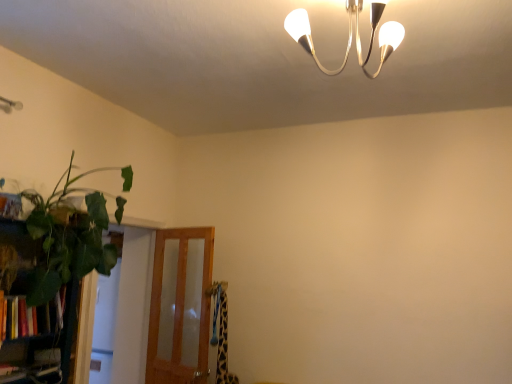
Question: Is hardcover books at left far from translucent wood screen door at lower left?

Choices:
 (A) yes
 (B) no

Answer: (A)

Question: Are hardcover books at left and translucent wood screen door at lower left beside each other?

Choices:
 (A) no
 (B) yes

Answer: (A)

Question: Is hardcover books at left looking in the opposite direction of translucent wood screen door at lower left?

Choices:
 (A) no
 (B) yes

Answer: (A)

Question: Is hardcover books at left oriented towards translucent wood screen door at lower left?

Choices:
 (A) yes
 (B) no

Answer: (B)

Question: Considering the relative sizes of hardcover books at left and translucent wood screen door at lower left in the image provided, is hardcover books at left bigger than translucent wood screen door at lower left?

Choices:
 (A) no
 (B) yes

Answer: (A)

Question: From a real-world perspective, is green leafy plant at left above or below green leafy plant at left?

Choices:
 (A) below
 (B) above

Answer: (A)

Question: Is green leafy plant at left bigger or smaller than green leafy plant at left?

Choices:
 (A) small
 (B) big

Answer: (A)

Question: Considering the positions of green leafy plant at left and green leafy plant at left in the image, is green leafy plant at left taller or shorter than green leafy plant at left?

Choices:
 (A) tall
 (B) short

Answer: (A)

Question: Is point (14, 352) closer or farther from the camera than point (28, 296)?

Choices:
 (A) closer
 (B) farther

Answer: (B)

Question: Visually, is green leafy plant at left positioned to the left or to the right of hardcover books at left?

Choices:
 (A) left
 (B) right

Answer: (B)

Question: From a real-world perspective, is green leafy plant at left above or below hardcover books at left?

Choices:
 (A) below
 (B) above

Answer: (B)

Question: Is point (34, 273) positioned closer to the camera than point (30, 307)?

Choices:
 (A) closer
 (B) farther

Answer: (A)

Question: Considering their positions, is green leafy plant at left located in front of or behind hardcover books at left?

Choices:
 (A) front
 (B) behind

Answer: (A)

Question: Is hardcover books at left to the left or to the right of green leafy plant at left in the image?

Choices:
 (A) left
 (B) right

Answer: (A)

Question: Is point (58, 317) positioned closer to the camera than point (97, 190)?

Choices:
 (A) farther
 (B) closer

Answer: (B)